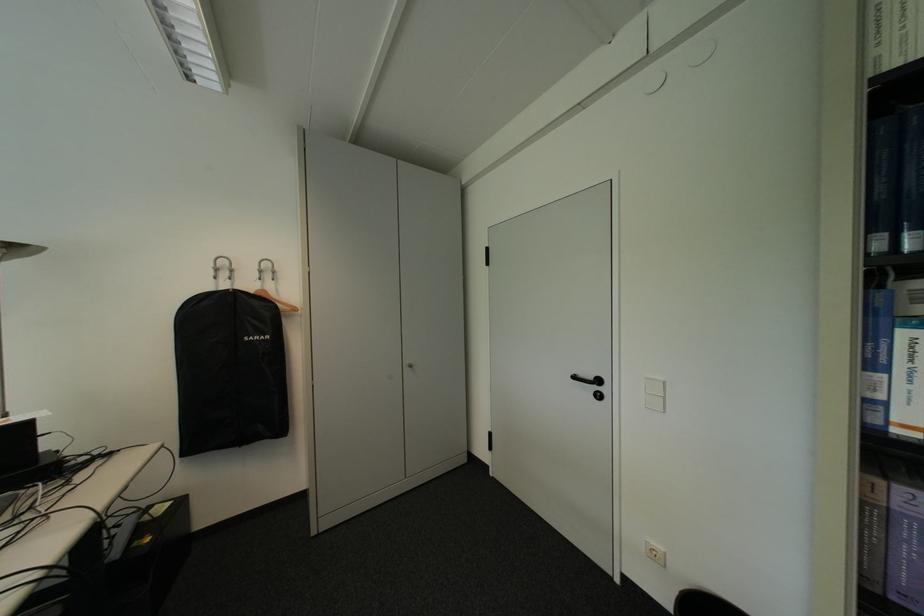
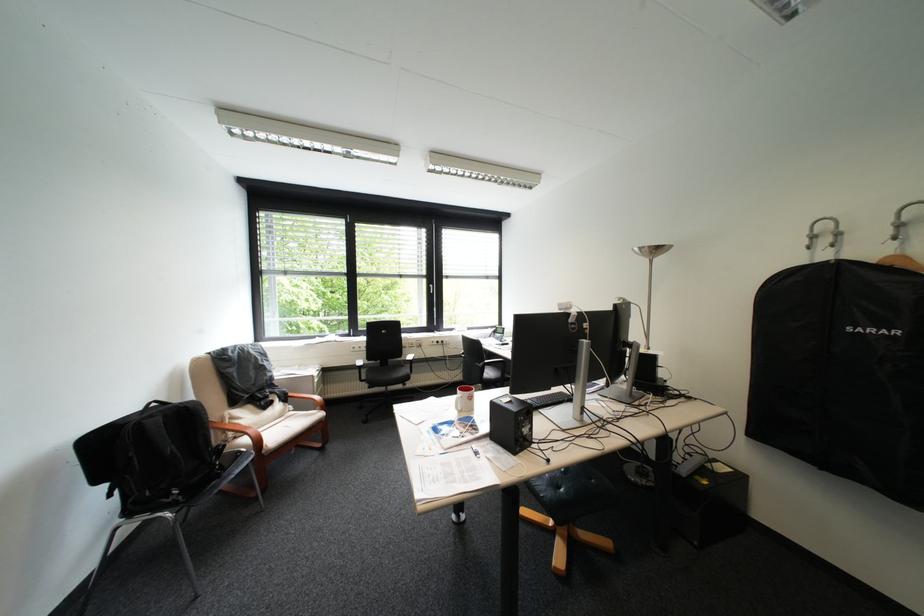
Question: The first image is from the beginning of the video and the second image is from the end. How did the camera likely rotate when shooting the video?

Choices:
 (A) Left
 (B) Right
 (C) Up
 (D) Down

Answer: (A)